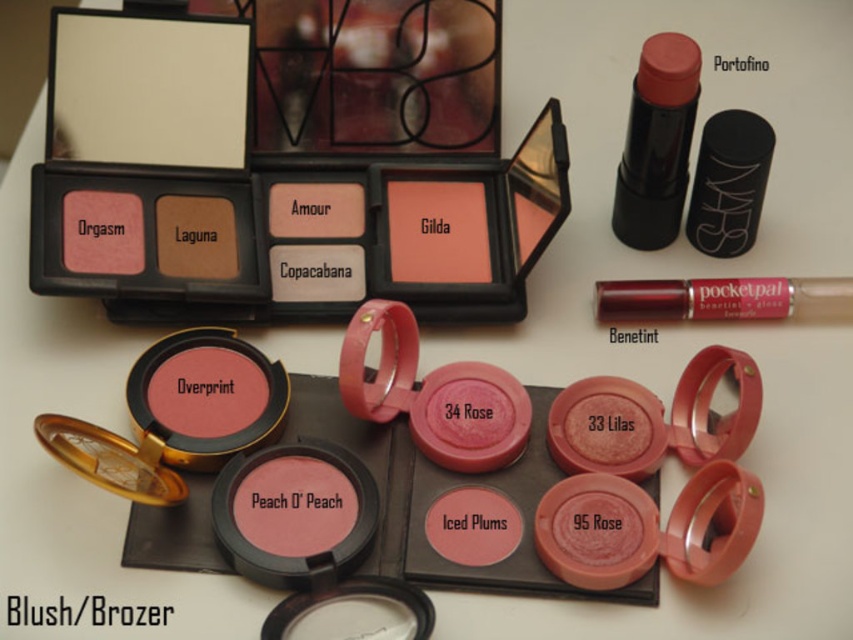
Question: Which of the following is the closest to the observer?

Choices:
 (A) (660, 282)
 (B) (653, 77)

Answer: (B)

Question: Is matte pink lipstick at upper right thinner than shiny metallic pocket pal at upper right?

Choices:
 (A) yes
 (B) no

Answer: (A)

Question: Is matte pink lipstick at upper right behind shiny metallic pocket pal at upper right?

Choices:
 (A) yes
 (B) no

Answer: (B)

Question: Does matte pink lipstick at upper right have a greater width compared to shiny metallic pocket pal at upper right?

Choices:
 (A) no
 (B) yes

Answer: (A)

Question: Which of the following is the farthest from the observer?

Choices:
 (A) (764, 280)
 (B) (672, 209)

Answer: (B)

Question: Which object appears closest to the camera in this image?

Choices:
 (A) shiny metallic pocket pal at upper right
 (B) matte pink lipstick at upper right

Answer: (B)